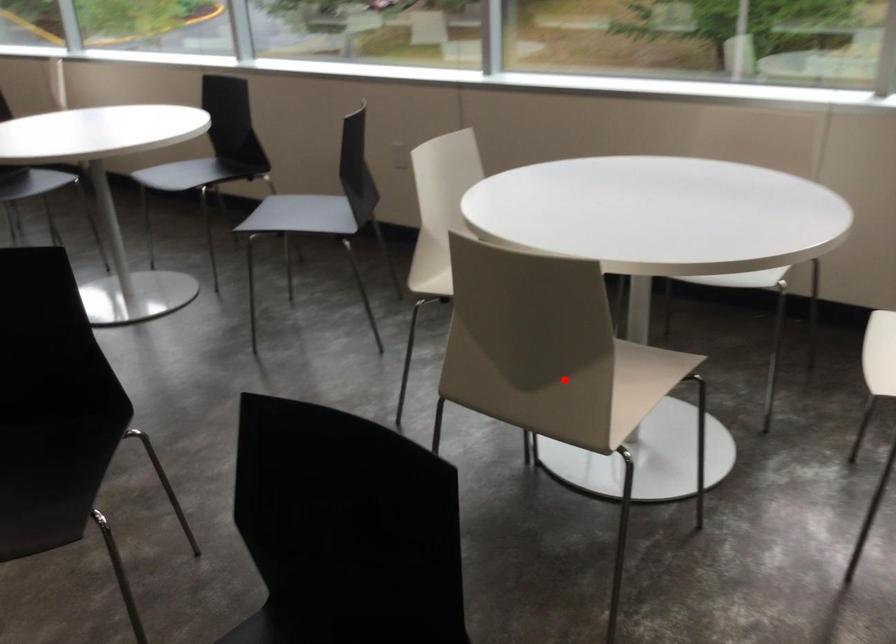
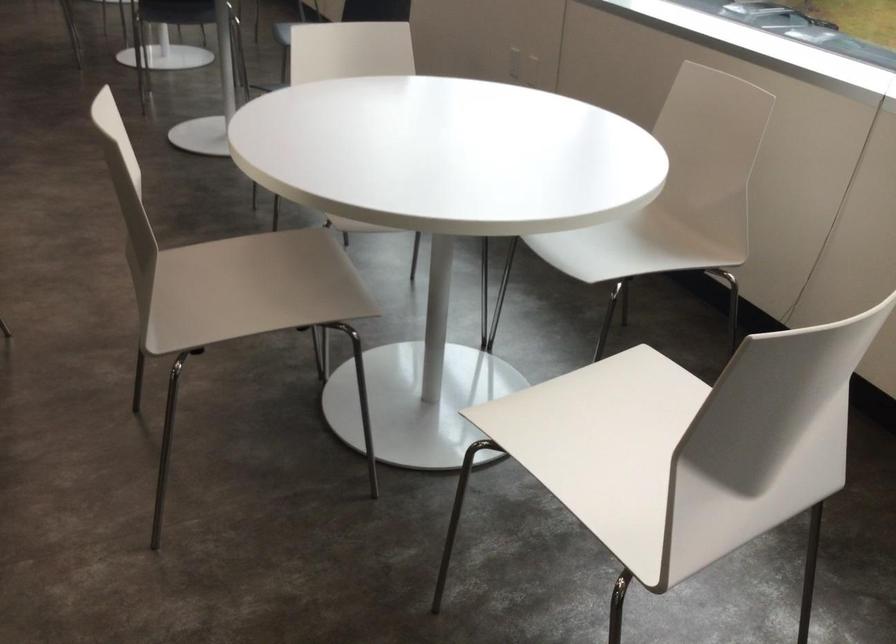
Question: I am providing you with two images of the same scene from different viewpoints. In image1, a red point is highlighted. Considering the same 3D point in image2, which of the following is correct?

Choices:
 (A) It is closer
 (B) It is farther

Answer: (B)